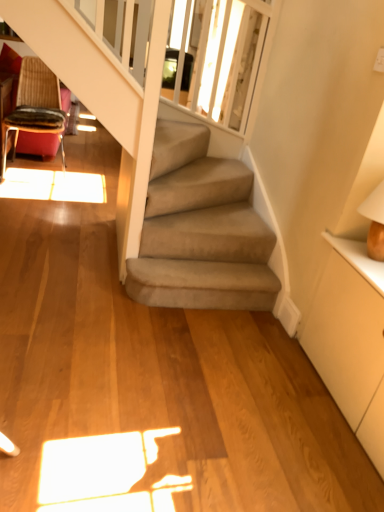
Image resolution: width=384 pixels, height=512 pixels. What are the coordinates of `free spot in front of wooden textured chair at upper left` in the screenshot? It's located at (39, 193).